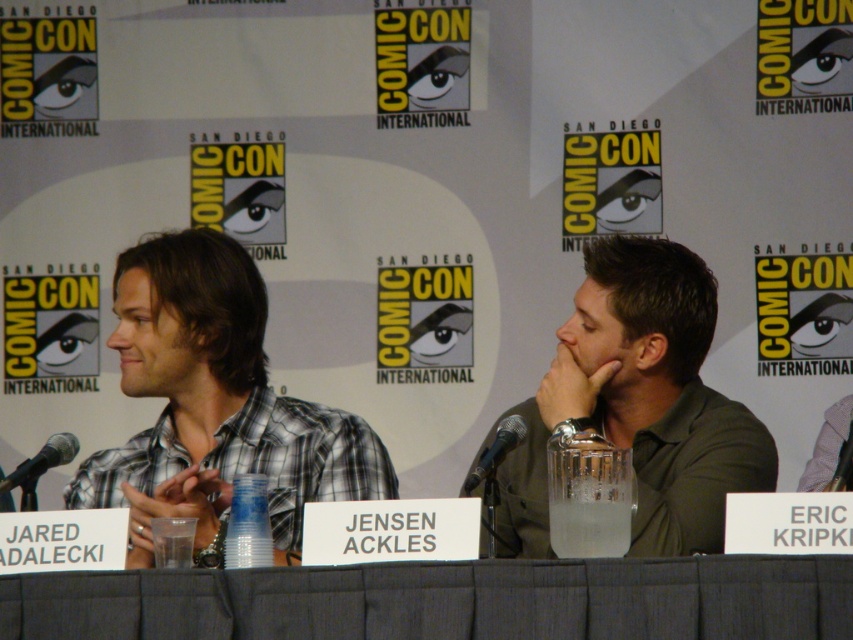
You are attending San Diego Comic Con and want to place a nameplate between the gray fabric table at center and the black metallic microphone at center. Based on their positions, which object should the nameplate be closer to?

The gray fabric table at center is positioned on the left side of black metallic microphone at center, so the nameplate should be placed closer to the gray fabric table at center since it is to the left of the microphone.

You are an attendee at San Diego Comic Con and you want to ask a question to the panelist who is closer to you. Which microphone should you approach, the black metallic microphone at left or the black metallic microphone at center?

The black metallic microphone at left is closer to you, so you should approach the black metallic microphone at left to ask your question.